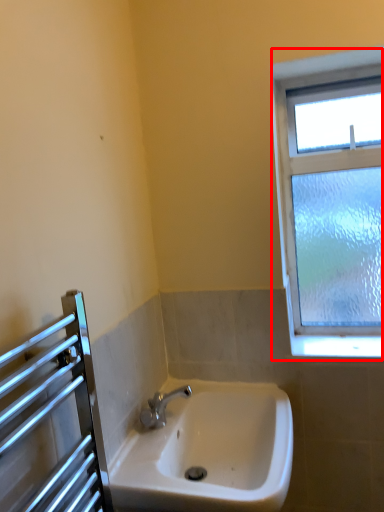
Question: From the image's perspective, what is the correct spatial positioning of window (annotated by the red box) in reference to sink?

Choices:
 (A) above
 (B) below

Answer: (A)